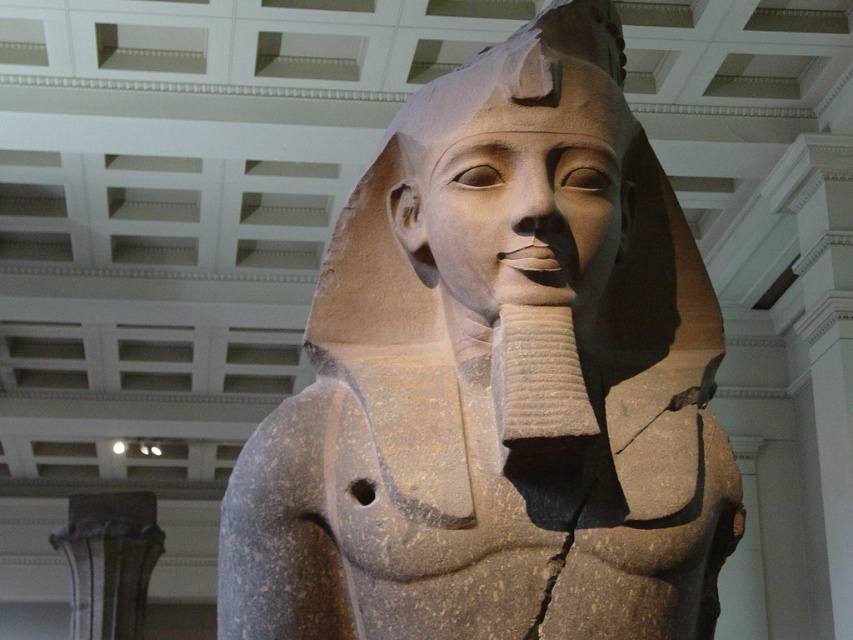
This screenshot has width=853, height=640. What do you see at coordinates (497, 380) in the screenshot? I see `gray stone statue at center` at bounding box center [497, 380].

Does gray stone statue at center have a larger size compared to smooth stone head at center?

Yes, gray stone statue at center is bigger than smooth stone head at center.

Is point (523, 273) more distant than point (508, 116)?

No, (523, 273) is in front of (508, 116).

At what (x,y) coordinates should I click in order to perform the action: click on gray stone statue at center. Please return your answer as a coordinate pair (x, y). Looking at the image, I should click on (497, 380).